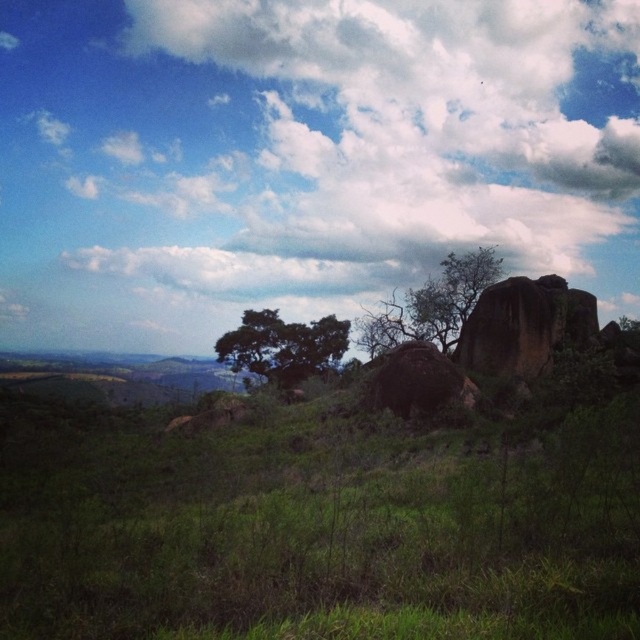
Describe the element at coordinates (432, 305) in the screenshot. I see `green leafy tree at upper right` at that location.

Measure the distance from green leafy tree at upper right to green leafy tree at center.

They are 17.41 meters apart.

Image resolution: width=640 pixels, height=640 pixels. In order to click on green leafy tree at upper right in this screenshot , I will do coord(432,305).

Between white fluffy cloud at upper center and green leafy tree at center, which one is positioned lower?

green leafy tree at center is below.

Based on the photo, can you confirm if white fluffy cloud at upper center is wider than green leafy tree at center?

Yes.

Who is more distant from viewer, (205, 272) or (268, 381)?

The point (205, 272) is behind.

Identify the location of white fluffy cloud at upper center. The image size is (640, 640). (304, 157).

Is white fluffy cloud at upper center to the left of green leafy tree at upper right from the viewer's perspective?

Indeed, white fluffy cloud at upper center is positioned on the left side of green leafy tree at upper right.

Is point (368, 81) positioned behind point (394, 308)?

That is True.

Is point (35, 163) positioned behind point (420, 323)?

Yes.

Where is `white fluffy cloud at upper center`? This screenshot has width=640, height=640. white fluffy cloud at upper center is located at coordinates (304, 157).